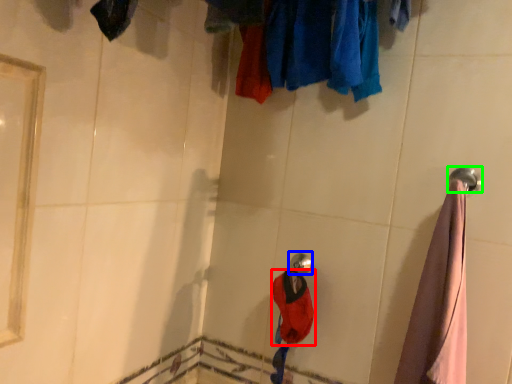
Question: Estimate the real-world distances between objects in this image. Which object is farther from clothing (highlighted by a red box), shower (highlighted by a blue box) or towel rack (highlighted by a green box)?

Choices:
 (A) shower
 (B) towel rack

Answer: (B)